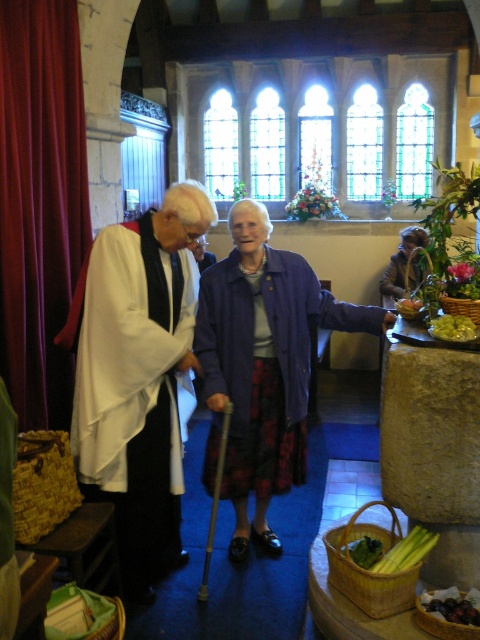
Based on the scene description, can you determine which object is taller between the white clothed figure at left and the velvet deep red curtain at left?

The white clothed figure at left has a lesser height compared to the velvet deep red curtain at left, so the velvet deep red curtain at left is taller.

You are a visitor in the church and see two coats hanging at the center. The purple fabric coat at center and the velvet brown coat at center. Which one is more to the left?

The purple fabric coat at center is more to the left because it is positioned on the left side of the velvet brown coat at center.